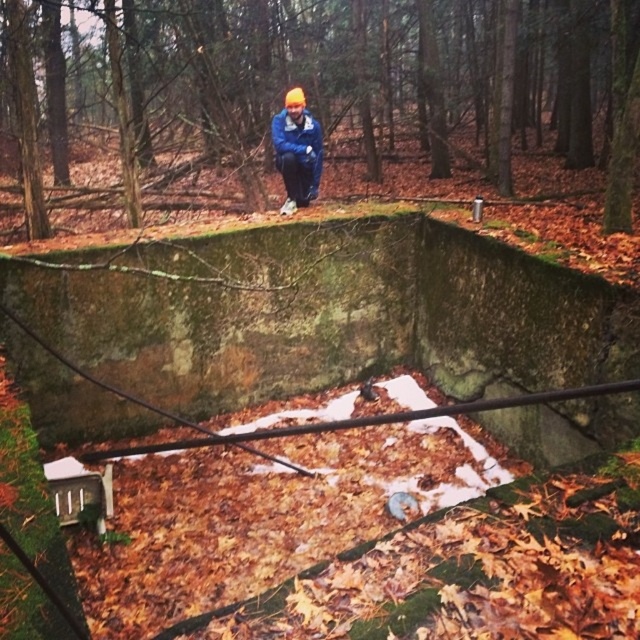
You are standing in a forested area with a large stone structure. You need to locate the green mossy stone at center. According to the coordinates provided, where exactly should you look to find it?

The green mossy stone at center is located at coordinates point (352,92).

You are standing in the forest scene described. You see the green mossy stone at center and the blue fleece jacket at center. Which object is located higher in the image?

The green mossy stone at center is positioned over the blue fleece jacket at center, so it is higher in the image.

Consider the image. You are a hiker who has come across this forest scene. You need to determine if your backpack, which is as large as your blue fleece jacket at center, can fit entirely on top of the green mossy stone at center. Can it?

The green mossy stone at center is larger in size than the blue fleece jacket at center, so yes, your backpack can fit entirely on top of the green mossy stone at center since the stone is bigger than the jacket.